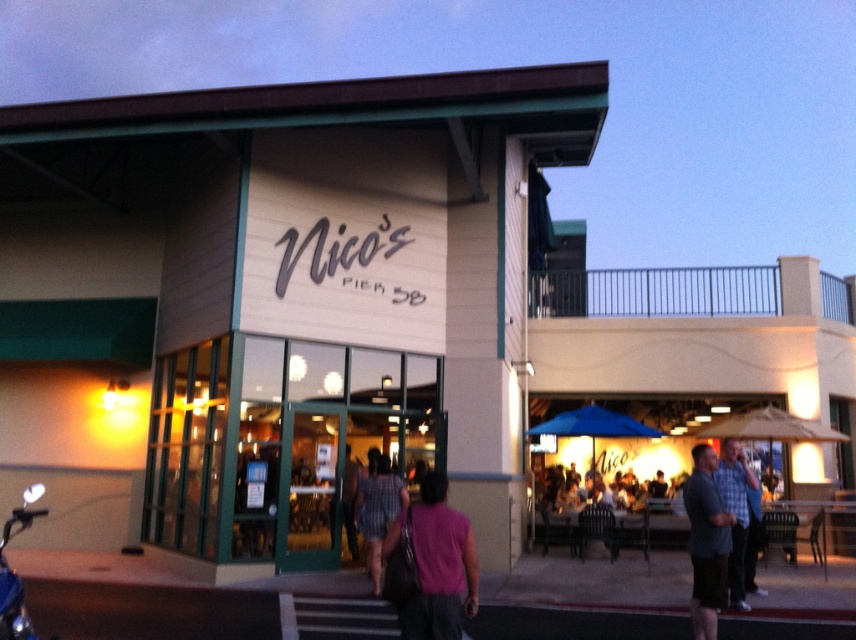
Question: Can you confirm if pink fabric shirt at center is bigger than plaid shirt at center?

Choices:
 (A) yes
 (B) no

Answer: (B)

Question: Among these points, which one is farthest from the camera?

Choices:
 (A) (0, 632)
 (B) (708, 492)
 (C) (736, 456)

Answer: (C)

Question: Which of the following is the closest to the observer?

Choices:
 (A) (741, 563)
 (B) (429, 476)
 (C) (3, 620)
 (D) (370, 540)

Answer: (C)

Question: Among these points, which one is farthest from the camera?

Choices:
 (A) (10, 576)
 (B) (385, 461)

Answer: (B)

Question: Does pink fabric shirt at center lie in front of matte gray shirt at center?

Choices:
 (A) yes
 (B) no

Answer: (A)

Question: Can you confirm if matte gray shirt at center is wider than shiny blue motorcycle at lower left?

Choices:
 (A) yes
 (B) no

Answer: (B)